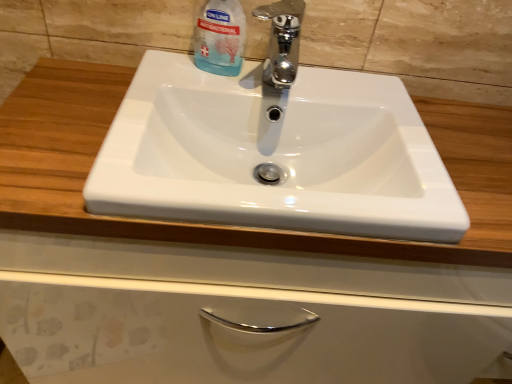
What are the coordinates of `vacant area that is situated to the right of chrome metallic faucet at center` in the screenshot? It's located at (359, 109).